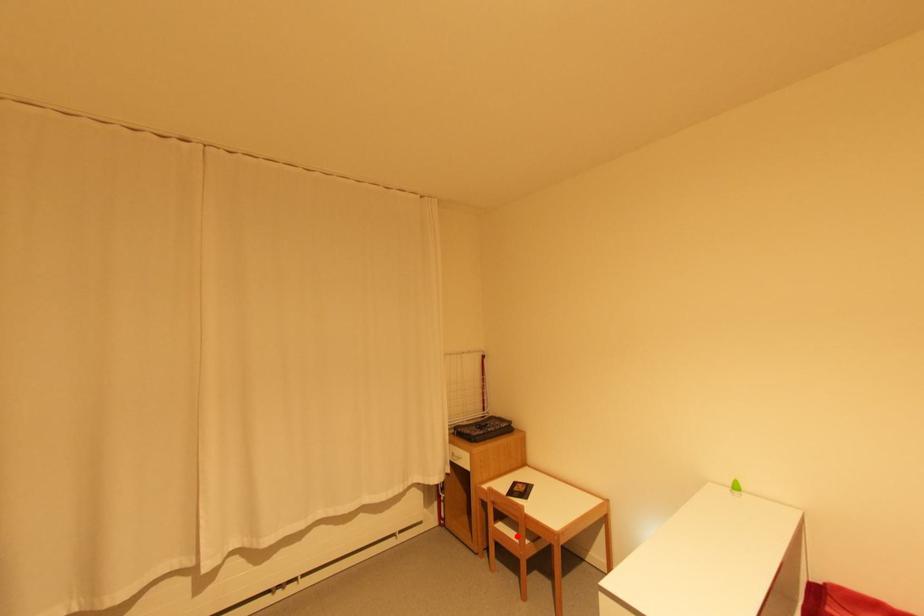
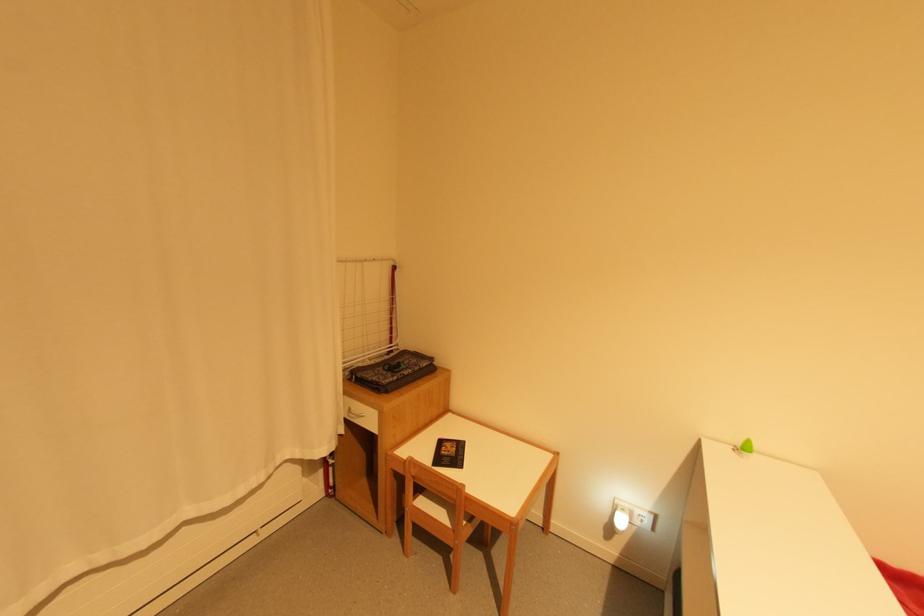
Question: I am providing you with two images of the same scene from different viewpoints. A red point is shown in image1. For the corresponding object point in image2, is it positioned nearer or farther from the camera?

Choices:
 (A) Nearer
 (B) Farther

Answer: (B)